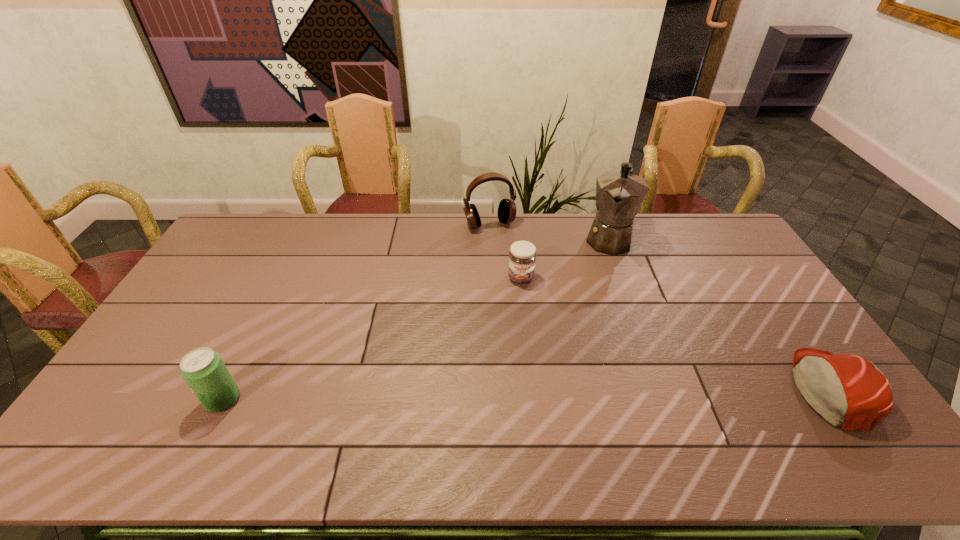
Locate an element on the screen. This screenshot has width=960, height=540. free space on the desktop that is between the third tallest object and the cap and is positioned on the front label of the third nearest object is located at coordinates (533, 394).

Identify the location of free spot on the desktop that is between the third shortest object and the rightmost object and is positioned on the ear pads of the second tallest object. (572, 394).

Locate an element on the screen. The height and width of the screenshot is (540, 960). free spot on the desktop that is between the third shortest object and the cap and is positioned on the pouring side of the coffeepot is located at coordinates (x=562, y=394).